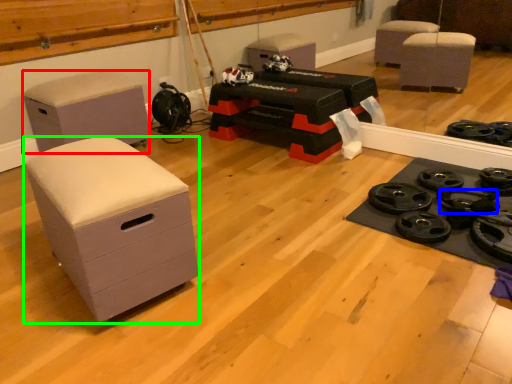
Question: Considering the real-world distances, which object is closest to furniture (highlighted by a red box)? wheel (highlighted by a blue box) or chest of drawers (highlighted by a green box).

Choices:
 (A) wheel
 (B) chest of drawers

Answer: (B)